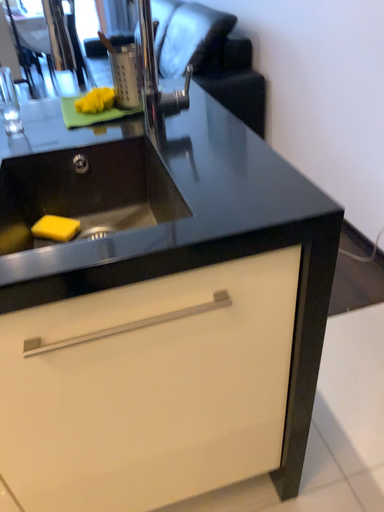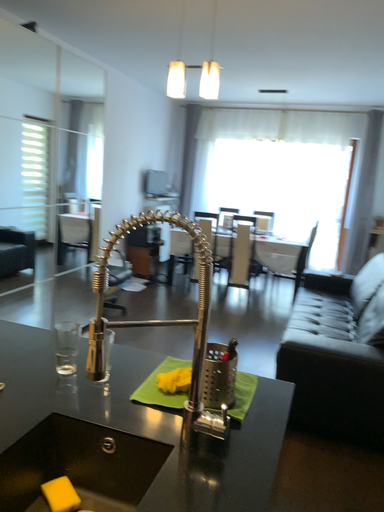
Question: How did the camera likely rotate when shooting the video?

Choices:
 (A) rotated right
 (B) rotated left

Answer: (B)